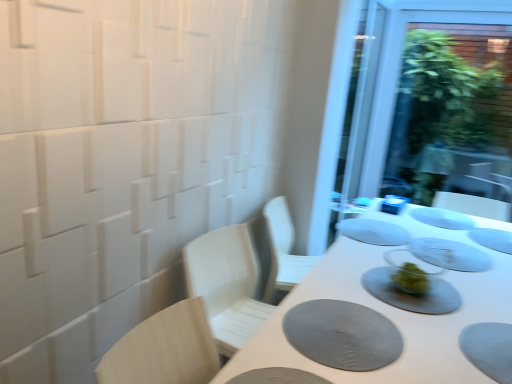
The height and width of the screenshot is (384, 512). In order to click on free region under gray textured placemat at lower right (from a real-world perspective) in this screenshot , I will do point(340,329).